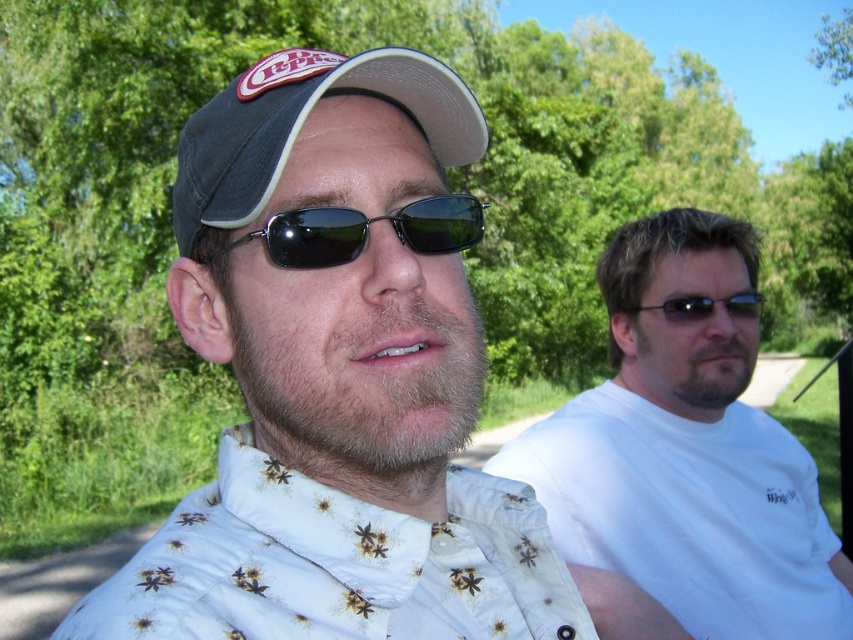
Based on the photo, you are standing at the point with coordinates point (233, 500) and want to walk to the point with coordinates point (625, 544). Based on the scene description, will you be moving towards the background or the foreground?

Since point (625, 544) is behind point (233, 500), you will be moving towards the background.

You are a photographer trying to capture a clear shot of the white floral shirt at center and the black matte sunglasses at center. Since both are in the same scene, which object should you focus on first to ensure it appears sharp in the photo?

The white floral shirt at center is in front of the black matte sunglasses at center, so focusing on the white floral shirt at center first will ensure it appears sharp, and the black matte sunglasses at center may also be in focus depending on the depth of field.